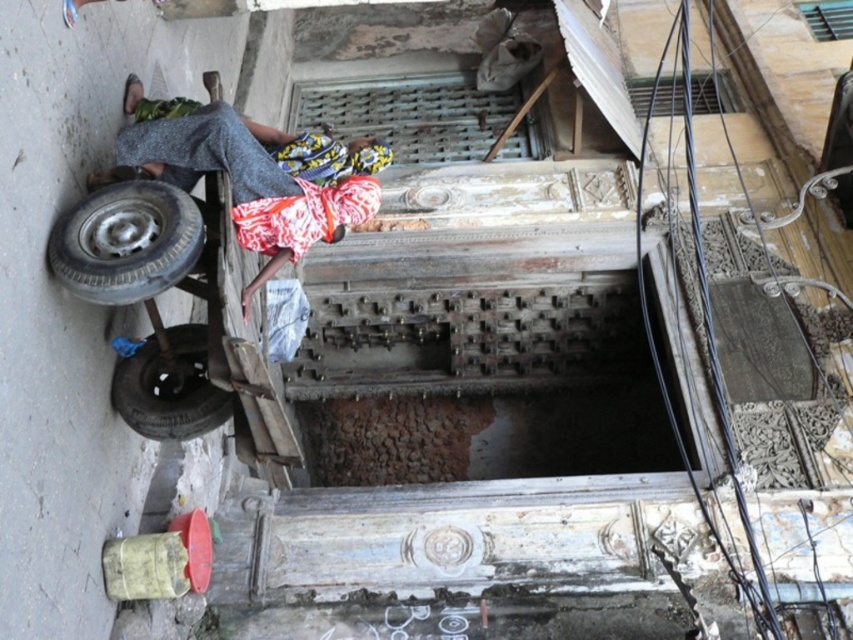
How distant is printed fabric headscarf at upper center from rubber/smooth tire at lower left?

printed fabric headscarf at upper center is 28.21 inches away from rubber/smooth tire at lower left.

Does printed fabric headscarf at upper center have a smaller size compared to rubber/smooth tire at lower left?

Actually, printed fabric headscarf at upper center might be larger than rubber/smooth tire at lower left.

Which is in front, point (258, 125) or point (93, 198)?

Point (93, 198) is in front.

Locate an element on the screen. printed fabric headscarf at upper center is located at coordinates (247, 182).

Which is more to the left, rubber/smooth tire at lower left or black rubber tire at lower left?

Positioned to the left is rubber/smooth tire at lower left.

Which is behind, point (86, 198) or point (183, 416)?

Point (183, 416)

Between point (65, 264) and point (200, 368), which one is positioned behind?

The point (200, 368) is more distant.

This screenshot has width=853, height=640. I want to click on rubber/smooth tire at lower left, so click(x=126, y=241).

Is printed fabric headscarf at upper center bigger than black rubber tire at lower left?

Yes, printed fabric headscarf at upper center is bigger than black rubber tire at lower left.

In the scene shown: Between printed fabric headscarf at upper center and black rubber tire at lower left, which one is positioned higher?

printed fabric headscarf at upper center is above.

Measure the distance between point [260,246] and camera.

A distance of 7.79 meters exists between point [260,246] and camera.

At what (x,y) coordinates should I click in order to perform the action: click on printed fabric headscarf at upper center. Please return your answer as a coordinate pair (x, y). This screenshot has width=853, height=640. Looking at the image, I should click on (247, 182).